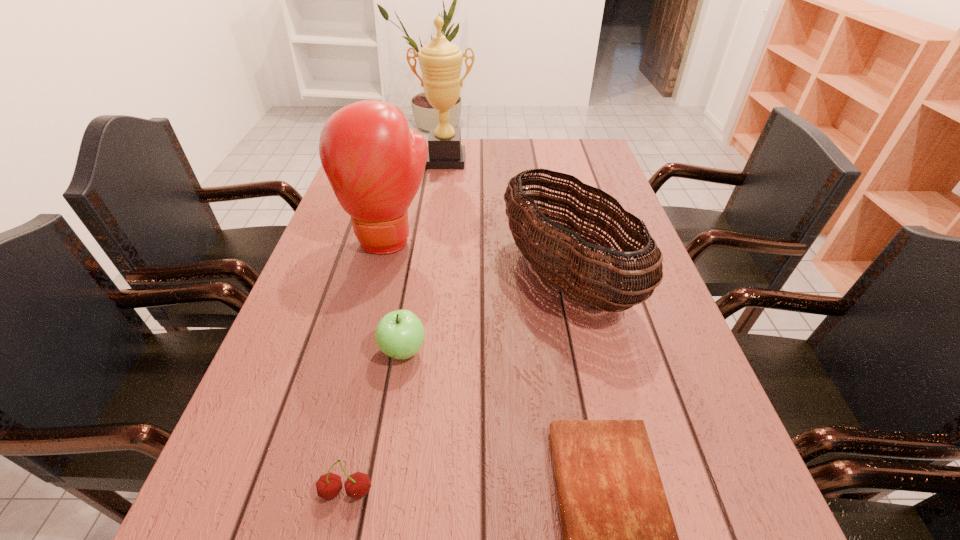
Image resolution: width=960 pixels, height=540 pixels. In order to click on the farthest object in this screenshot , I will do `click(440, 61)`.

Locate an element on the screen. the tallest object is located at coordinates (440, 61).

The image size is (960, 540). I want to click on boxing glove, so click(x=375, y=165).

Identify the location of the fourth shortest object. (569, 267).

Identify the location of cherry. Image resolution: width=960 pixels, height=540 pixels. (357, 485).

The height and width of the screenshot is (540, 960). I want to click on apple, so click(x=400, y=334).

This screenshot has width=960, height=540. Find the location of `vacant region located at the front of the tallest object with handles`. vacant region located at the front of the tallest object with handles is located at coordinates (442, 198).

What are the coordinates of `vacant region located 0.190m on the striking surface of the boxing glove` in the screenshot? It's located at (368, 322).

Locate an element on the screen. This screenshot has height=540, width=960. vacant space located on the back of the basket is located at coordinates (541, 161).

Locate an element on the screen. This screenshot has height=540, width=960. vacant space located 0.090m on the front of the apple is located at coordinates (393, 412).